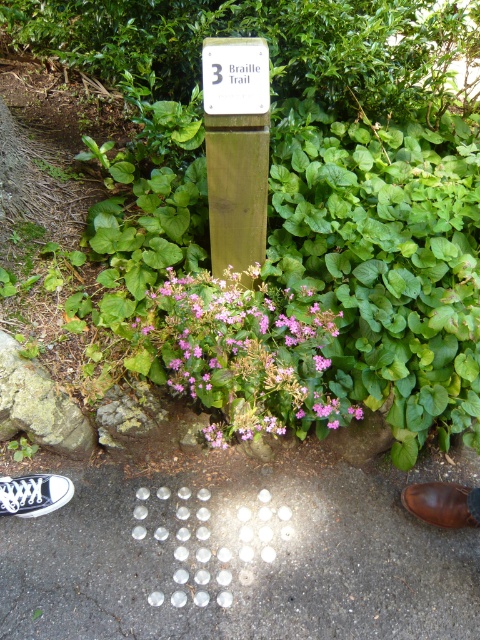
You are a visually impaired person navigating the garden path. You feel a translucent glass arrow at center and pink matte flowers at center. How far apart are these two objects?

The translucent glass arrow at center and pink matte flowers at center are 15.34 inches apart.

You are a visually impaired person using a cane to navigate the garden path. You encounter the translucent glass arrow at center and the white plastic sign at center. Which object should you follow for guidance, and why?

You should follow the translucent glass arrow at center because it is bigger than the white plastic sign at center, making it easier to detect with your cane.